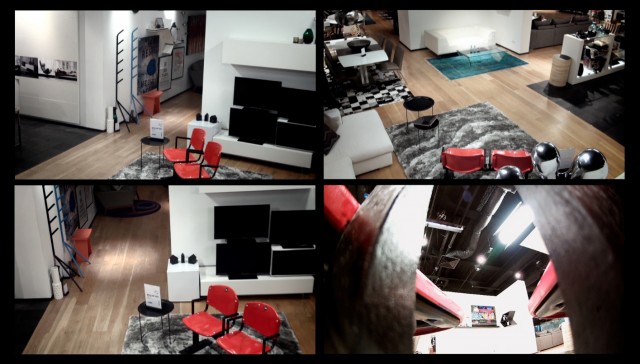
Find the location of a particular element. This screenshot has height=364, width=640. monitor is located at coordinates (259, 96).